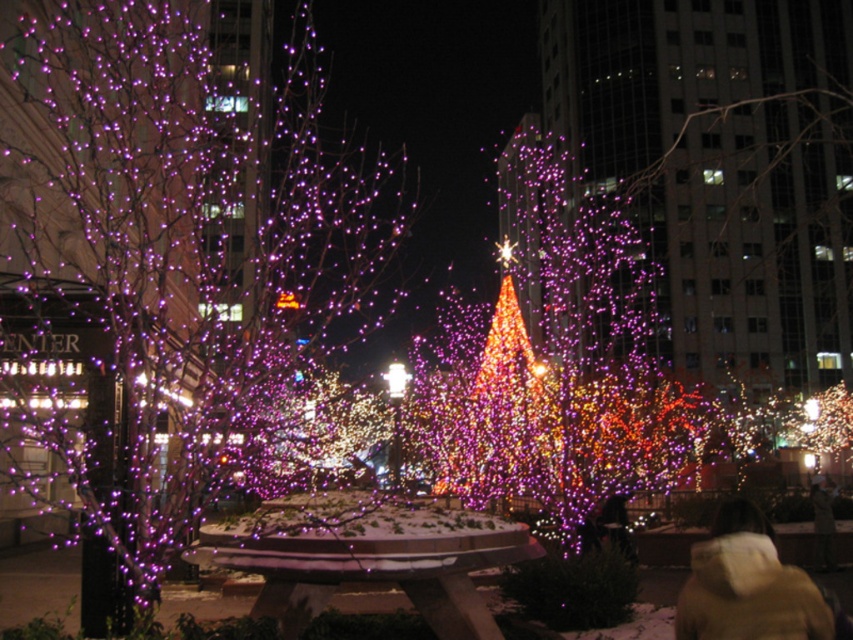
Question: Is tan quilted jacket at lower right above illuminated glass christmas tree at center?

Choices:
 (A) no
 (B) yes

Answer: (A)

Question: Is purple glossy tree at center smaller than tan quilted jacket at lower right?

Choices:
 (A) yes
 (B) no

Answer: (B)

Question: Among these points, which one is nearest to the camera?

Choices:
 (A) (679, 602)
 (B) (521, 438)
 (C) (152, 84)

Answer: (A)

Question: Among these points, which one is nearest to the camera?

Choices:
 (A) (821, 612)
 (B) (498, 259)

Answer: (A)

Question: Does purple glossy tree at center appear over tan quilted jacket at lower right?

Choices:
 (A) yes
 (B) no

Answer: (A)

Question: Estimate the real-world distances between objects in this image. Which object is farther from the purple glossy tree at center?

Choices:
 (A) illuminated glass christmas tree at center
 (B) tan quilted jacket at lower right

Answer: (B)